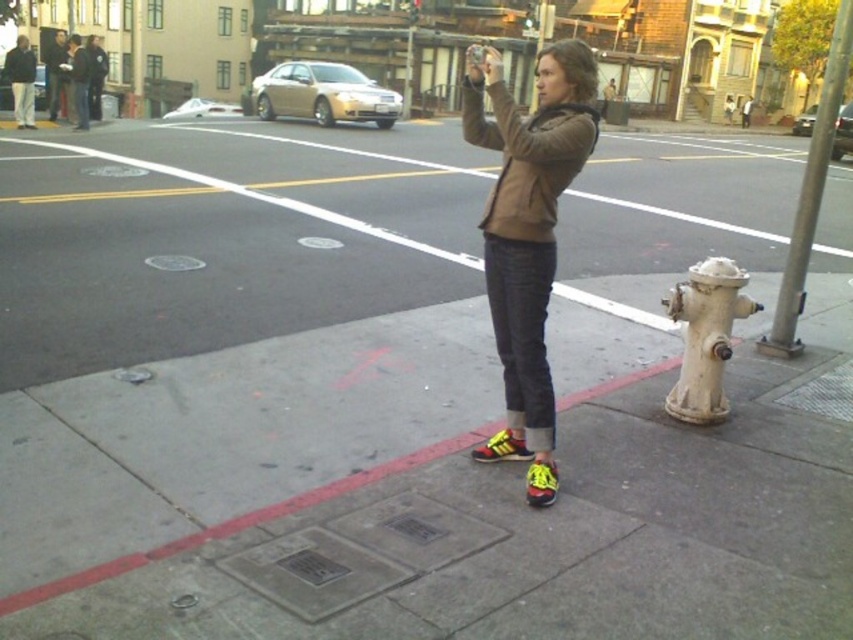
Is white matte hydrant at lower right wider than yellow synthetic shoe at center?

Yes.

What do you see at coordinates (705, 337) in the screenshot? I see `white matte hydrant at lower right` at bounding box center [705, 337].

Identify the location of white matte hydrant at lower right. (705, 337).

Who is more distant from viewer, (538, 316) or (244, 518)?

Point (538, 316)

Is matte brown jacket at center to the left of red concrete curb at lower center from the viewer's perspective?

No, matte brown jacket at center is not to the left of red concrete curb at lower center.

Where is `matte brown jacket at center`? The image size is (853, 640). matte brown jacket at center is located at coordinates (527, 212).

Can you confirm if matte brown jacket at center is bigger than metallic gray pole at right?

Actually, matte brown jacket at center might be smaller than metallic gray pole at right.

The width and height of the screenshot is (853, 640). Identify the location of matte brown jacket at center. pyautogui.click(x=527, y=212).

Locate an element on the screen. This screenshot has height=640, width=853. matte brown jacket at center is located at coordinates (527, 212).

Locate an element on the screen. matte brown jacket at center is located at coordinates (527, 212).